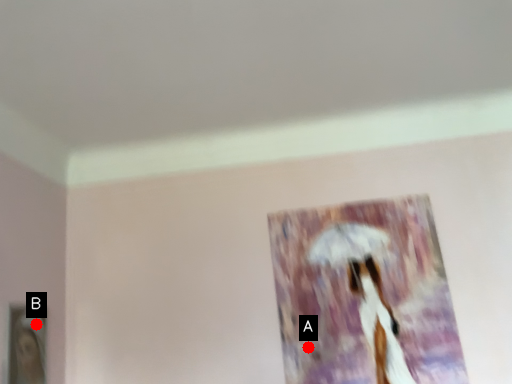
Question: Two points are circled on the image, labeled by A and B beside each circle. Which of the following is the farthest from the observer?

Choices:
 (A) A is further
 (B) B is further

Answer: (A)